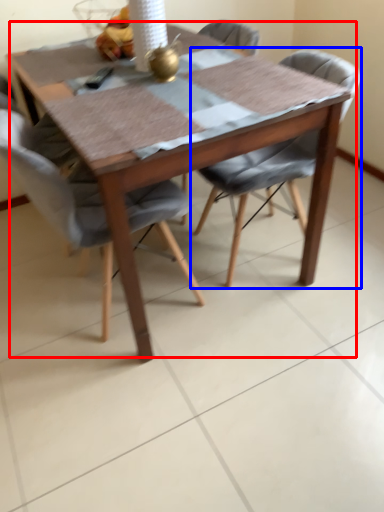
Question: Which object is further to the camera taking this photo, kitchen & dining room table (highlighted by a red box) or chair (highlighted by a blue box)?

Choices:
 (A) kitchen & dining room table
 (B) chair

Answer: (B)